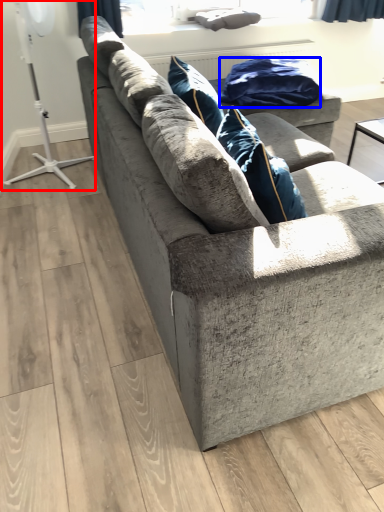
Question: Which point is further to the camera, fan (highlighted by a red box) or material (highlighted by a blue box)?

Choices:
 (A) fan
 (B) material

Answer: (B)